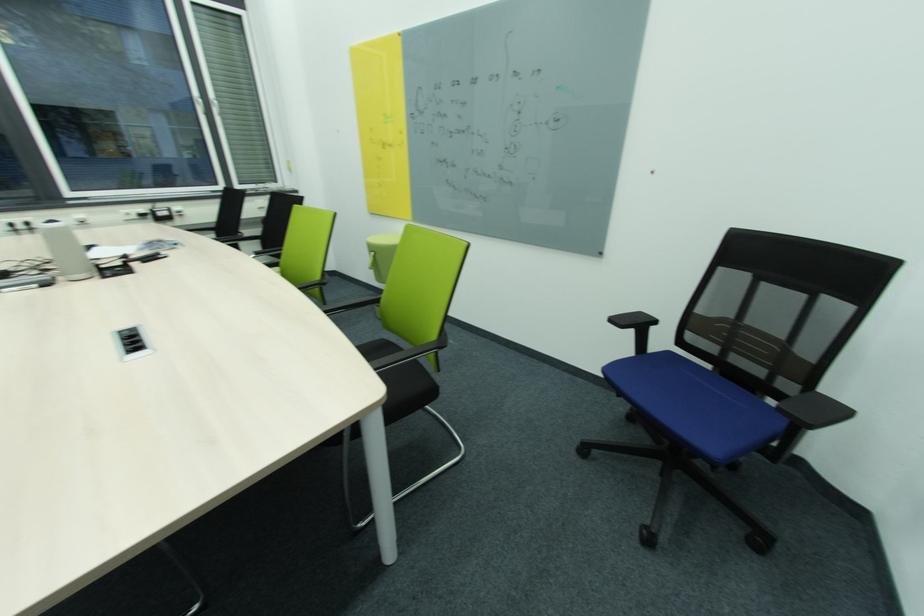
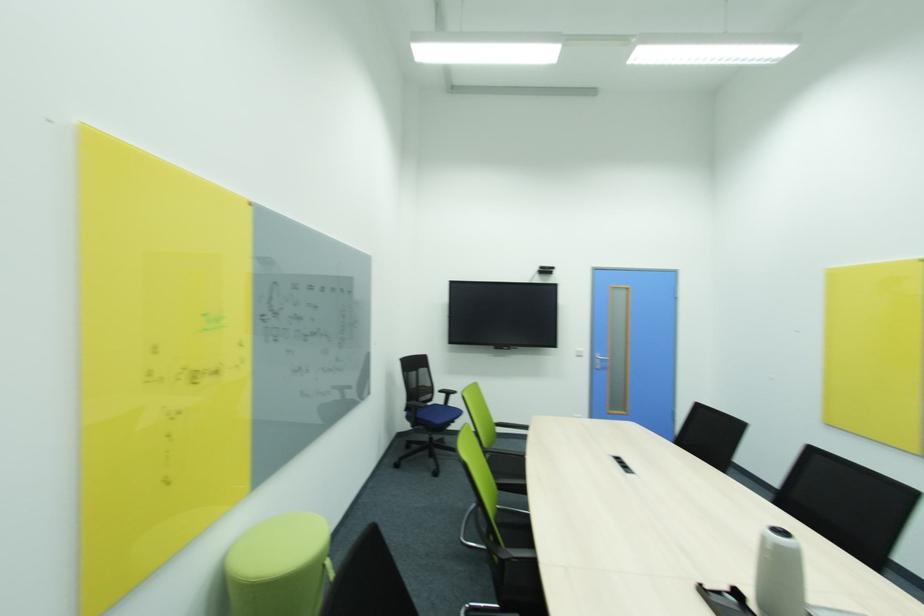
Locate, in the second image, the point that corresponds to [837,307] in the first image.

(428, 371)